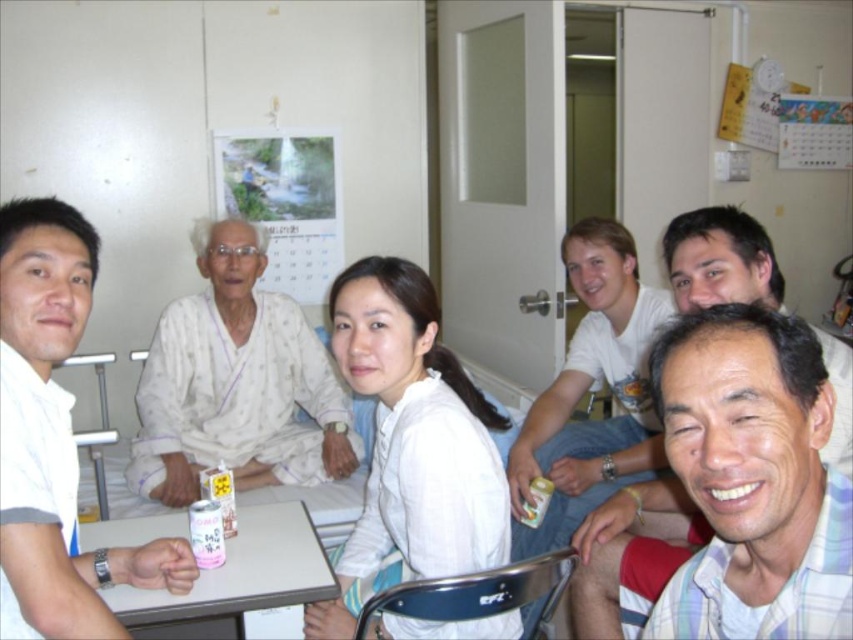
You are a nurse in a hospital room and need to place a medical chart on the white plastic table at lower center. The chart is 30 inches long. Can you fit it on the table without overlapping the white cotton pajamas at center?

The white cotton pajamas at center and white plastic table at lower center are 29.05 inches apart. Since the chart is 30 inches long, it would overlap the white cotton pajamas at center when placed on the table.

You are a nurse in the hospital room and need to determine if the white plastic table at lower center can fit between the white cotton pajamas at center and the wall. Based on their sizes, can the table fit?

The white cotton pajamas at center is wider than the white plastic table at lower center. Since the pajamas are wider, there might not be enough space between them and the wall for the table to fit. However, without knowing the exact distance between the pajamas and the wall, it is uncertain if the table can fit.

You are a nurse entering the hospital room and need to check the calendar. Are the white cotton pajamas at center blocking your view of the printed paper calendar at upper center?

The white cotton pajamas at center might be wider than the printed paper calendar at upper center, so there is a possibility that the pajamas are blocking the calendar. You should move closer or adjust your angle to see it better.